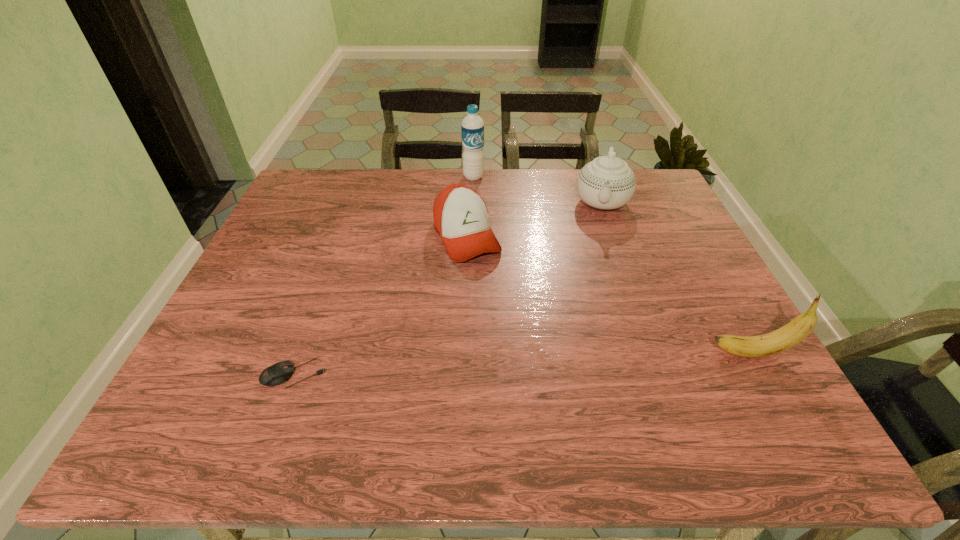
Where is `vacant space that is in between the rightmost object and the baseball cap`? The height and width of the screenshot is (540, 960). vacant space that is in between the rightmost object and the baseball cap is located at coordinates (609, 295).

This screenshot has height=540, width=960. Identify the location of free space between the rightmost object and the fourth object from left to right. (677, 278).

Locate an element on the screen. The height and width of the screenshot is (540, 960). unoccupied position between the second shortest object and the rightmost object is located at coordinates (609, 295).

What are the coordinates of `free area in between the rightmost object and the baseball cap` in the screenshot? It's located at (609, 295).

Locate an element on the screen. free space that is in between the chinaware and the baseball cap is located at coordinates (x=534, y=219).

Locate an element on the screen. This screenshot has width=960, height=540. object that is the fourth closest to the chinaware is located at coordinates (279, 373).

Where is `object that is the fourth closest to the banana`? object that is the fourth closest to the banana is located at coordinates (472, 127).

The height and width of the screenshot is (540, 960). I want to click on vacant position in the image that satisfies the following two spatial constraints: 1. on the back side of the leftmost object; 2. at the start of the peel on the rightmost object, so click(x=301, y=353).

Find the location of a particular element. Image resolution: width=960 pixels, height=540 pixels. vacant space that satisfies the following two spatial constraints: 1. on the back side of the water bottle; 2. on the left side of the shortest object is located at coordinates (367, 177).

The height and width of the screenshot is (540, 960). Find the location of `vacant area in the image that satisfies the following two spatial constraints: 1. on the back side of the baseball cap; 2. on the left side of the mouse`. vacant area in the image that satisfies the following two spatial constraints: 1. on the back side of the baseball cap; 2. on the left side of the mouse is located at coordinates (345, 237).